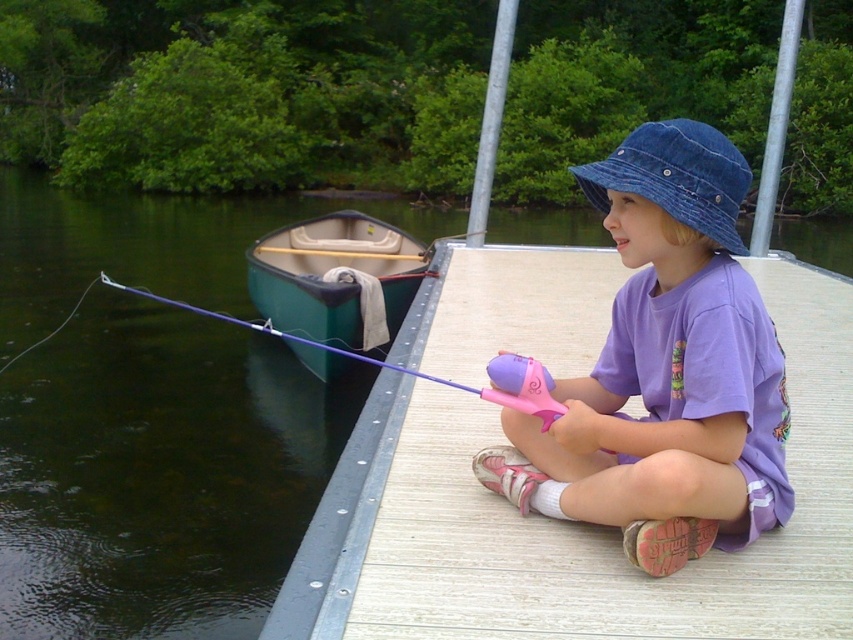
Question: Which point appears farthest from the camera in this image?

Choices:
 (A) (704, 212)
 (B) (482, 388)
 (C) (698, 154)
 (D) (364, 220)

Answer: (D)

Question: Which point appears farthest from the camera in this image?

Choices:
 (A) (280, 250)
 (B) (674, 289)
 (C) (630, 147)
 (D) (109, 278)

Answer: (D)

Question: Is the position of clear water at dock left less distant than that of purple cotton shirt at center?

Choices:
 (A) no
 (B) yes

Answer: (A)

Question: Is clear water at dock left to the right of denim blue hat at upper center from the viewer's perspective?

Choices:
 (A) yes
 (B) no

Answer: (B)

Question: Which of the following is the farthest from the observer?

Choices:
 (A) (735, 500)
 (B) (379, 320)
 (C) (254, 218)

Answer: (C)

Question: In this image, where is clear water at dock left located relative to denim blue hat at upper center?

Choices:
 (A) below
 (B) above

Answer: (A)